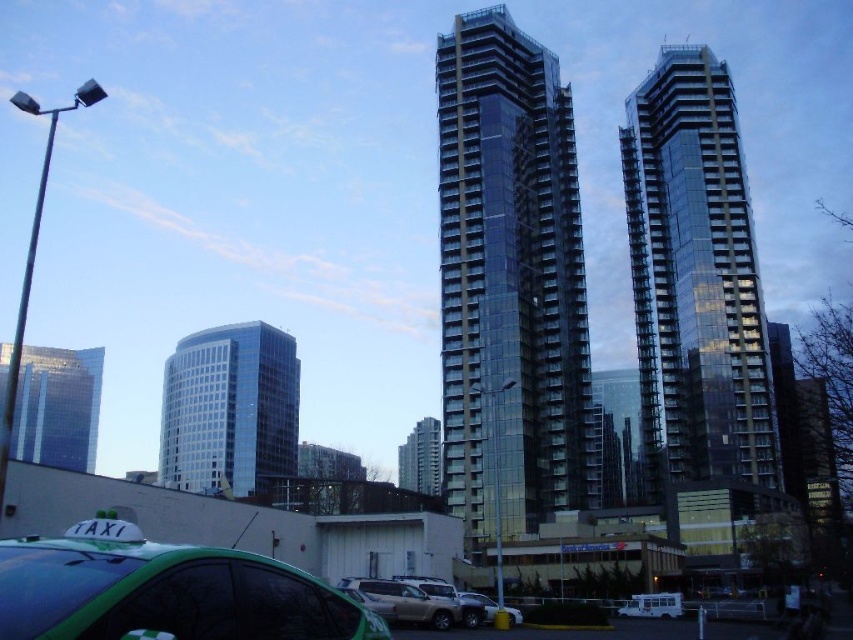
In the scene shown: You are a delivery drone that needs to fly from the matte silver suv at center to the glassy metallic building at center. The drone can only fly up to 200 meters. Can it make the trip without needing to recharge?

The matte silver suv at center is 215.09 meters from the glassy metallic building at center, so the drone cannot make the trip without recharging as it exceeds its 200 meter range.

You are a photographer planning to capture the glassy reflective skyscraper at left and the metallic silver suv at center in a single frame. Given that the skyscraper is larger in the image, which object would appear closer to the camera in the final photo?

The glassy reflective skyscraper at left appears closer to the camera because it is bigger than the metallic silver suv at center in the photo.

You are a city planner evaluating the skyline of this urban area. You need to determine which of the two buildings, the blue glass building at center or the glassy metallic building at center, would cast a longer shadow during midday. Based on the scene description, which building would cast a longer shadow?

The blue glass building at center is larger in size than the glassy metallic building at center, so it would cast a longer shadow during midday.